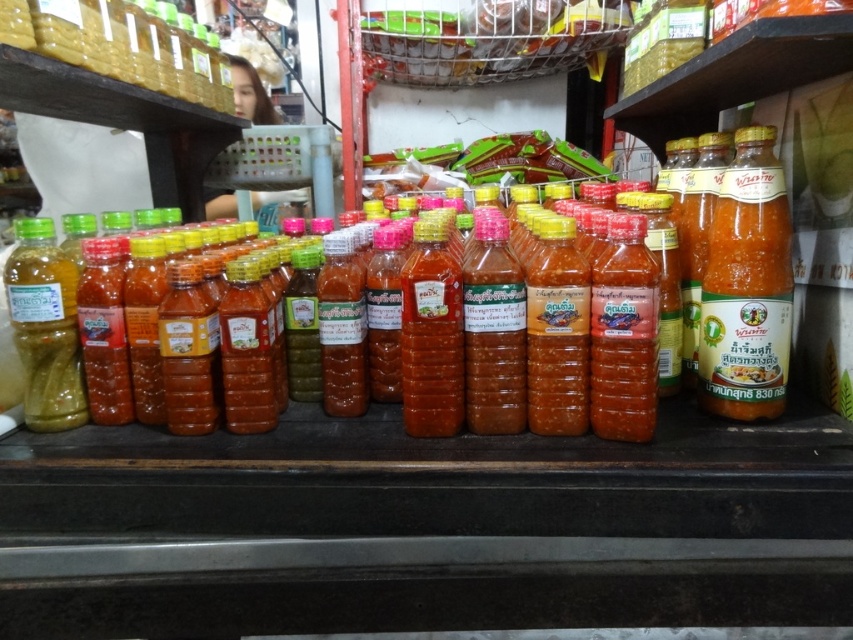
Question: Observing the image, what is the correct spatial positioning of translucent orange sauce at center in reference to green matte bottle at left?

Choices:
 (A) below
 (B) above

Answer: (B)

Question: Which of the following is the farthest from the observer?

Choices:
 (A) green matte bottle at left
 (B) translucent orange sauce at center

Answer: (B)

Question: Can you confirm if translucent orange sauce at center is wider than green matte bottle at left?

Choices:
 (A) no
 (B) yes

Answer: (A)

Question: From the image, what is the correct spatial relationship of translucent orange sauce at center in relation to green matte bottle at left?

Choices:
 (A) right
 (B) left

Answer: (A)